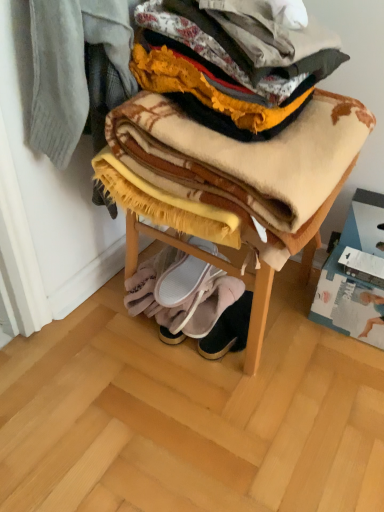
Question: Is white suede slippers at lower center, positioned as the first footwear in top-to-bottom order, wider than plaid woolen blanket at center, acting as the 1th blanket starting from the top?

Choices:
 (A) yes
 (B) no

Answer: (B)

Question: Is white suede slippers at lower center, positioned as the first footwear in top-to-bottom order, to the left of plaid woolen blanket at center, which is counted as the 2th blanket, starting from the back, from the viewer's perspective?

Choices:
 (A) yes
 (B) no

Answer: (A)

Question: Considering the relative sizes of white suede slippers at lower center, which is the 3th footwear in bottom-to-top order, and plaid woolen blanket at center, the 2th blanket in the bottom-to-top sequence, in the image provided, is white suede slippers at lower center, which is the 3th footwear in bottom-to-top order, smaller than plaid woolen blanket at center, the 2th blanket in the bottom-to-top sequence,?

Choices:
 (A) no
 (B) yes

Answer: (B)

Question: From the image's perspective, is white suede slippers at lower center, which is the 3th footwear in bottom-to-top order, on plaid woolen blanket at center, acting as the 1th blanket starting from the top?

Choices:
 (A) no
 (B) yes

Answer: (A)

Question: From a real-world perspective, is white suede slippers at lower center, positioned as the first footwear in top-to-bottom order, under plaid woolen blanket at center, which is counted as the first blanket, starting from the front?

Choices:
 (A) yes
 (B) no

Answer: (A)

Question: Visually, is white suede slippers at lower center, which is the 3th footwear in bottom-to-top order, positioned to the left or to the right of white fabric slipper at lower center, which ranks as the second footwear in bottom-to-top order?

Choices:
 (A) left
 (B) right

Answer: (A)

Question: Considering the positions of point (190, 241) and point (238, 287), is point (190, 241) closer or farther from the camera than point (238, 287)?

Choices:
 (A) farther
 (B) closer

Answer: (B)

Question: Is white suede slippers at lower center, positioned as the first footwear in top-to-bottom order, inside or outside of white fabric slipper at lower center, the second footwear viewed from the top?

Choices:
 (A) outside
 (B) inside

Answer: (A)

Question: In terms of height, does white suede slippers at lower center, positioned as the first footwear in top-to-bottom order, look taller or shorter compared to white fabric slipper at lower center, which ranks as the second footwear in bottom-to-top order?

Choices:
 (A) short
 (B) tall

Answer: (A)

Question: Is white fabric slipper at lower center, the second footwear viewed from the top, to the left or to the right of soft yellow fleece blanket at lower center, marked as the 1th blanket in a bottom-to-top arrangement, in the image?

Choices:
 (A) right
 (B) left

Answer: (A)

Question: Looking at their shapes, would you say white fabric slipper at lower center, the second footwear viewed from the top, is wider or thinner than soft yellow fleece blanket at lower center, which is the first blanket from back to front?

Choices:
 (A) thin
 (B) wide

Answer: (A)

Question: In terms of size, does white fabric slipper at lower center, which ranks as the second footwear in bottom-to-top order, appear bigger or smaller than soft yellow fleece blanket at lower center, which is the 2th blanket from top to bottom?

Choices:
 (A) small
 (B) big

Answer: (A)

Question: Choose the correct answer: Is white fabric slipper at lower center, the second footwear viewed from the top, inside soft yellow fleece blanket at lower center, which is the 2th blanket from top to bottom, or outside it?

Choices:
 (A) inside
 (B) outside

Answer: (A)

Question: Is leather suede booties at lower center, positioned as the 1th footwear in bottom-to-top order, situated inside soft woolen blanket at center or outside?

Choices:
 (A) outside
 (B) inside

Answer: (A)

Question: From the image's perspective, is leather suede booties at lower center, positioned as the 1th footwear in bottom-to-top order, located above or below soft woolen blanket at center?

Choices:
 (A) above
 (B) below

Answer: (B)